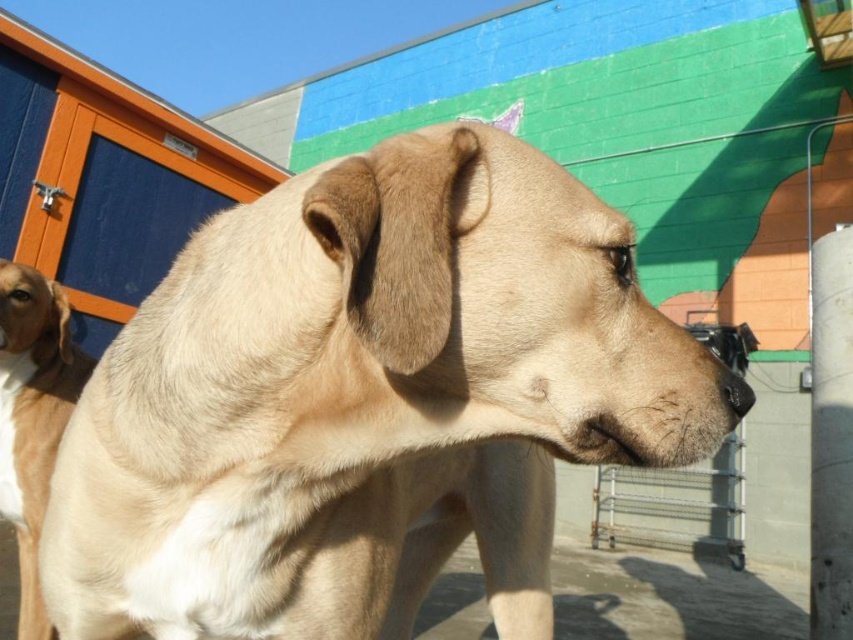
Question: Which point is closer to the camera?

Choices:
 (A) (218, 225)
 (B) (16, 477)

Answer: (A)

Question: Is fuzzy beige dog at center wider than light brown fur at left?

Choices:
 (A) yes
 (B) no

Answer: (A)

Question: Which point appears closest to the camera in this image?

Choices:
 (A) (30, 408)
 (B) (49, 561)

Answer: (B)

Question: Does fuzzy beige dog at center lie in front of light brown fur at left?

Choices:
 (A) yes
 (B) no

Answer: (A)

Question: Can you confirm if fuzzy beige dog at center is wider than light brown fur at left?

Choices:
 (A) yes
 (B) no

Answer: (A)